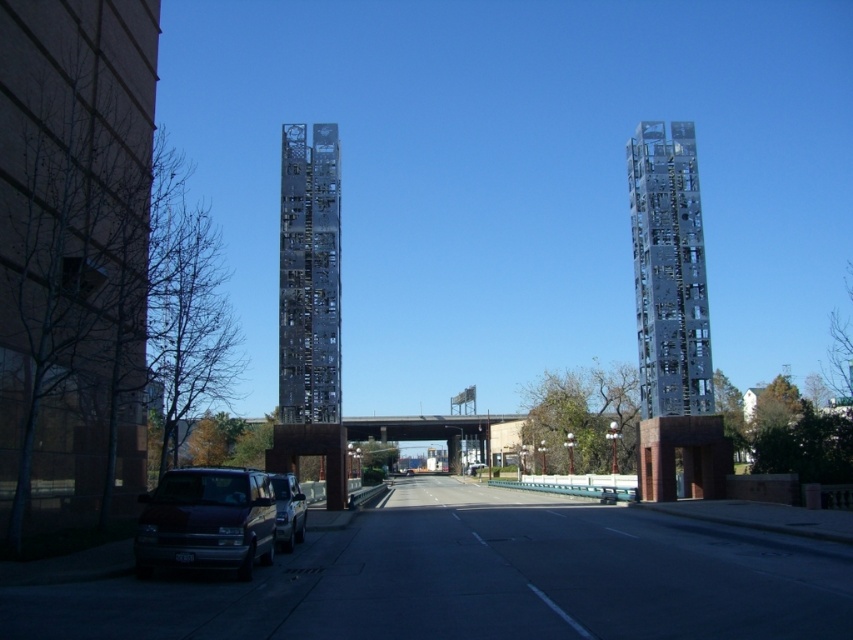
Does metallic grid structure at right lie behind metallic silver suv at lower left?

Yes, metallic grid structure at right is further from the viewer.

Does point (677, 241) come in front of point (271, 481)?

No, it is behind (271, 481).

Which is behind, point (654, 241) or point (276, 531)?

Point (654, 241)

I want to click on metallic grid structure at right, so click(x=668, y=272).

Can you confirm if metallic grid structure at right is taller than matte dark purple van at lower left?

Yes.

Is point (660, 243) farther from camera compared to point (169, 560)?

That is True.

What are the coordinates of `metallic grid structure at right` in the screenshot? It's located at (668, 272).

Can you confirm if matte dark purple van at lower left is positioned to the left of metallic silver suv at lower left?

No, matte dark purple van at lower left is not to the left of metallic silver suv at lower left.

Is matte dark purple van at lower left shorter than metallic silver suv at lower left?

Correct, matte dark purple van at lower left is not as tall as metallic silver suv at lower left.

Where is `matte dark purple van at lower left`? The image size is (853, 640). matte dark purple van at lower left is located at coordinates (206, 522).